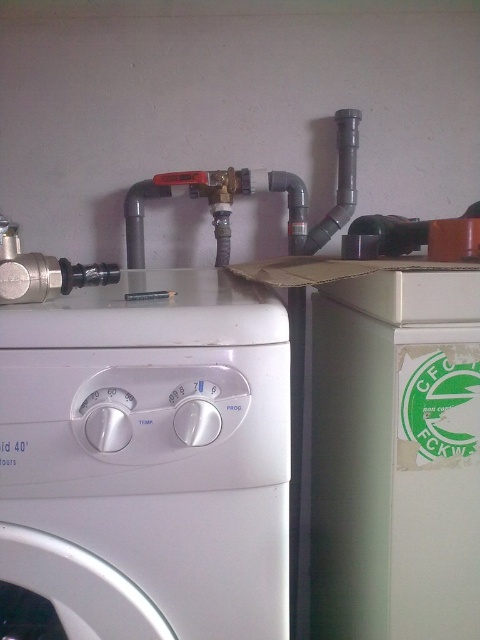
You are moving a new white plastic washing machine at center into a utility area. The existing gray matte pipe at upper center is in the way. Can the washing machine fit through the space between the pipe and the wall?

The white plastic washing machine at center is thinner than the gray matte pipe at upper center. Therefore, the washing machine can fit through the space between the pipe and the wall since it is narrower than the pipe.

You are standing in front of the washing machine and see two points marked on the pipes above it. The first point is at coordinates point (196, 394) and the second point is at point (277, 188). Which point is closer to you?

Point (196, 394) is in front of point (277, 188), so it is closer to you.

In the scene shown: You are standing in the utility area and need to access the gray matte pipe at upper center to perform maintenance. However, the white plastic washing machine at center is blocking your path. Can you move the washing machine to reach the pipe?

The white plastic washing machine at center is in front of the gray matte pipe at upper center, so moving the washing machine would allow you to access the pipe.